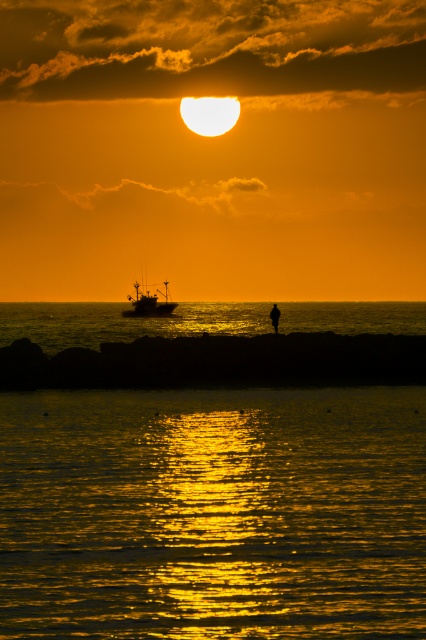
Question: Does smooth rock shoreline at lower center come in front of silhouette fishing boat at center?

Choices:
 (A) yes
 (B) no

Answer: (A)

Question: Among these objects, which one is farthest from the camera?

Choices:
 (A) smooth rock shoreline at lower center
 (B) silhouette fishing boat at center

Answer: (B)

Question: In this image, where is glistening golden water at center located relative to smooth rock shoreline at lower center?

Choices:
 (A) above
 (B) below

Answer: (B)

Question: Which of the following is the farthest from the observer?

Choices:
 (A) glistening golden water at center
 (B) smooth rock shoreline at lower center

Answer: (B)

Question: Based on their relative distances, which object is nearer to the silhouette fishing boat at center?

Choices:
 (A) glistening golden water at center
 (B) smooth rock shoreline at lower center

Answer: (B)

Question: Is glistening golden water at center wider than smooth rock shoreline at lower center?

Choices:
 (A) yes
 (B) no

Answer: (B)